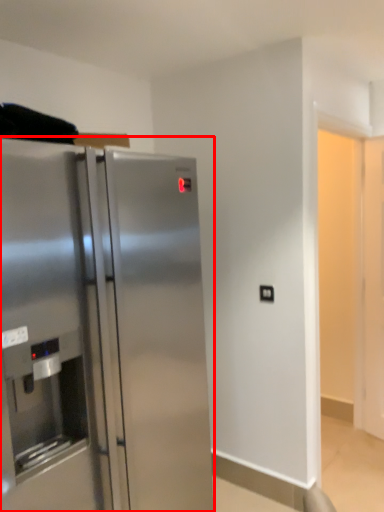
Question: Considering the relative positions of refrigerator (annotated by the red box) and electric outlet in the image provided, where is refrigerator (annotated by the red box) located with respect to the staircase?

Choices:
 (A) left
 (B) right

Answer: (A)